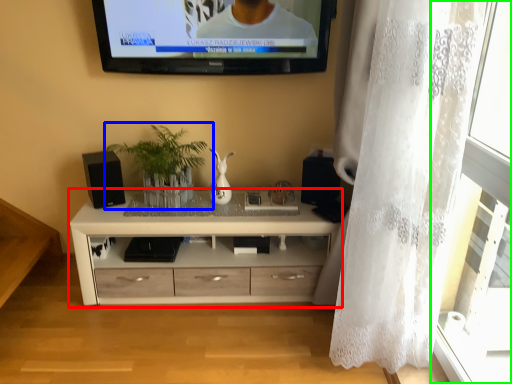
Question: Which object is positioned farthest from chest of drawers (highlighted by a red box)? Select from houseplant (highlighted by a blue box) and glass door (highlighted by a green box).

Choices:
 (A) houseplant
 (B) glass door

Answer: (B)